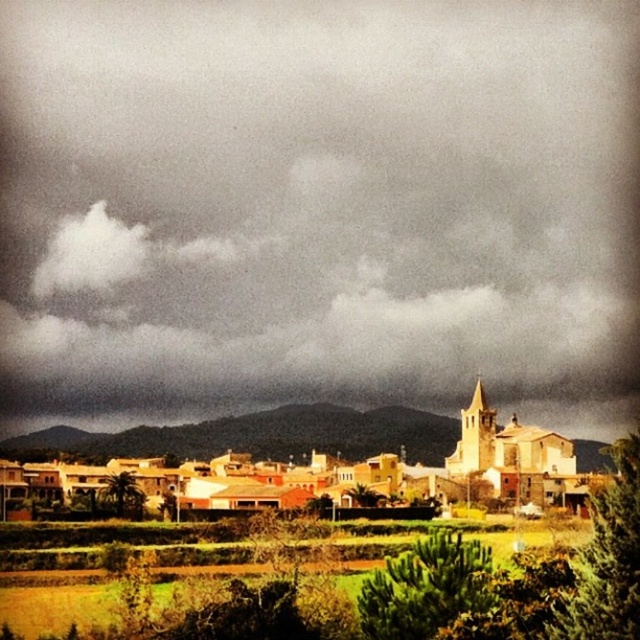
Question: Considering the real-world distances, which object is farthest from the dark gray cloud at upper center?

Choices:
 (A) white stucco buildings at center
 (B) light brown stone church at center

Answer: (B)

Question: Which point is farther to the camera?

Choices:
 (A) dark gray cloud at upper center
 (B) light brown stone church at center
 (C) white stucco buildings at center

Answer: (A)

Question: Among these points, which one is nearest to the camera?

Choices:
 (A) click(544, 460)
 (B) click(65, 408)
 (C) click(416, 419)

Answer: (A)

Question: Can you confirm if dark gray cloud at upper center is positioned to the left of light brown stone church at center?

Choices:
 (A) no
 (B) yes

Answer: (B)

Question: Can you confirm if dark gray cloud at upper center is bigger than white stucco buildings at center?

Choices:
 (A) no
 (B) yes

Answer: (B)

Question: Does dark gray cloud at upper center lie in front of white stucco buildings at center?

Choices:
 (A) yes
 (B) no

Answer: (B)